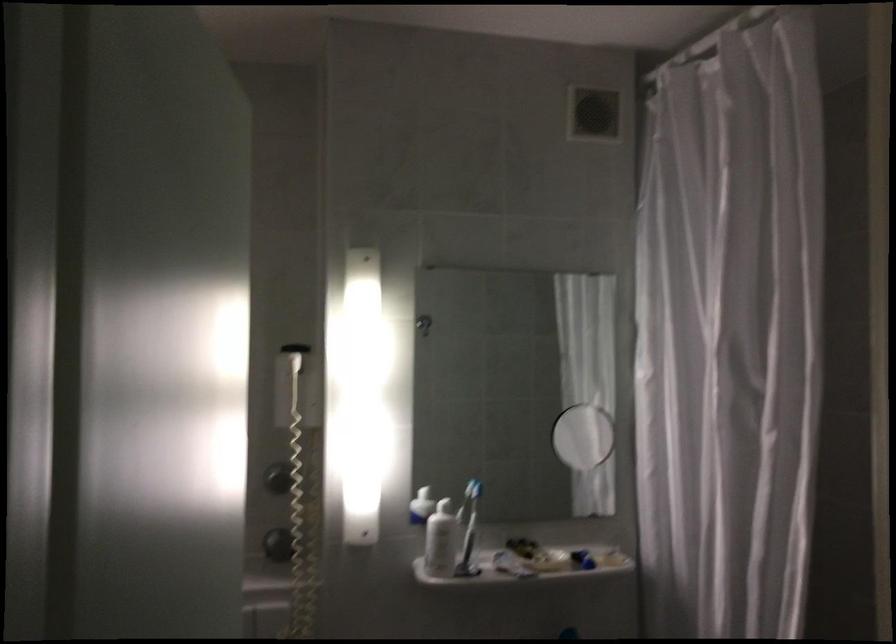
What do you see at coordinates (295, 386) in the screenshot? Image resolution: width=896 pixels, height=644 pixels. I see `the dispenser pump head` at bounding box center [295, 386].